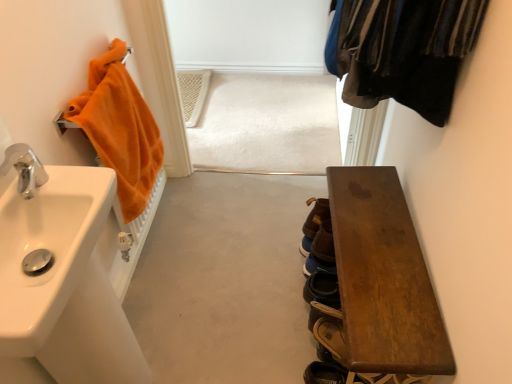
Locate an element on the screen. free spot above wooden bench at lower right (from a real-world perspective) is located at coordinates (x=377, y=243).